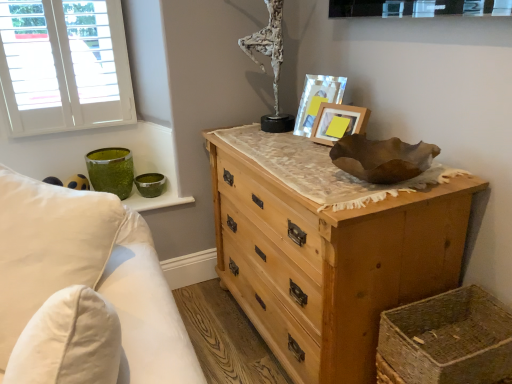
Question: From a real-world perspective, is natural wood chest of drawers at center located higher than matte wooden picture frame at upper right, which is the second picture frame in front-to-back order?

Choices:
 (A) no
 (B) yes

Answer: (A)

Question: Is natural wood chest of drawers at center wider than matte wooden picture frame at upper right, which is the second picture frame in front-to-back order?

Choices:
 (A) yes
 (B) no

Answer: (A)

Question: Considering the relative sizes of natural wood chest of drawers at center and matte wooden picture frame at upper right, which is the second picture frame in front-to-back order, in the image provided, is natural wood chest of drawers at center smaller than matte wooden picture frame at upper right, which is the second picture frame in front-to-back order,?

Choices:
 (A) yes
 (B) no

Answer: (B)

Question: Can you confirm if natural wood chest of drawers at center is positioned to the right of matte wooden picture frame at upper right, the 1th picture frame when ordered from back to front?

Choices:
 (A) no
 (B) yes

Answer: (A)

Question: Is natural wood chest of drawers at center to the left of matte wooden picture frame at upper right, which is the second picture frame in front-to-back order, from the viewer's perspective?

Choices:
 (A) yes
 (B) no

Answer: (A)

Question: Is the position of natural wood chest of drawers at center less distant than that of matte wooden picture frame at upper right, the 1th picture frame when ordered from back to front?

Choices:
 (A) no
 (B) yes

Answer: (B)

Question: Could you tell me if white painted wood window at upper left is facing woven straw basket at lower right?

Choices:
 (A) yes
 (B) no

Answer: (A)

Question: From a real-world perspective, is white painted wood window at upper left physically above woven straw basket at lower right?

Choices:
 (A) yes
 (B) no

Answer: (A)

Question: Is white painted wood window at upper left located outside woven straw basket at lower right?

Choices:
 (A) no
 (B) yes

Answer: (B)

Question: Can you confirm if white painted wood window at upper left is bigger than woven straw basket at lower right?

Choices:
 (A) no
 (B) yes

Answer: (A)

Question: Is white painted wood window at upper left at the left side of woven straw basket at lower right?

Choices:
 (A) yes
 (B) no

Answer: (A)

Question: Does white painted wood window at upper left have a lesser width compared to woven straw basket at lower right?

Choices:
 (A) no
 (B) yes

Answer: (B)

Question: Is the surface of white textured sculpture at upper center in direct contact with white painted wood window at upper left?

Choices:
 (A) yes
 (B) no

Answer: (B)